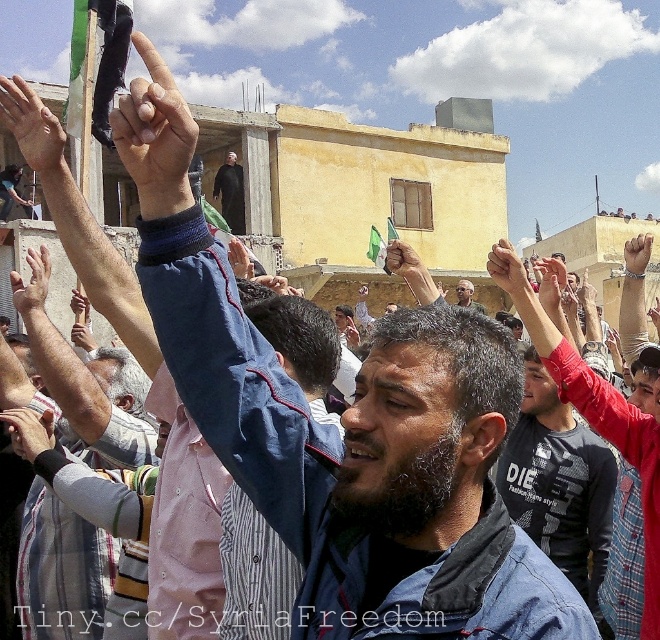
Between blue denim jacket at center and matte black hand at center, which one appears on the right side from the viewer's perspective?

blue denim jacket at center is more to the right.

Is blue denim jacket at center wider than matte black hand at center?

Yes, blue denim jacket at center is wider than matte black hand at center.

Locate an element on the screen. The height and width of the screenshot is (640, 660). blue denim jacket at center is located at coordinates (364, 460).

Between matte black hand at upper center and matte black flag at upper left, which one appears on the left side from the viewer's perspective?

matte black flag at upper left

Locate an element on the screen. This screenshot has width=660, height=640. matte black hand at upper center is located at coordinates (154, 134).

Who is positioned more to the right, blue denim jacket at center or smooth skin hand at center?

From the viewer's perspective, blue denim jacket at center appears more on the right side.

Who is more forward, (508,538) or (42,307)?

Positioned in front is point (508,538).

Which is behind, point (385, 602) or point (28, 284)?

Positioned behind is point (28, 284).

Find the location of `blue denim jacket at center`. blue denim jacket at center is located at coordinates (364, 460).